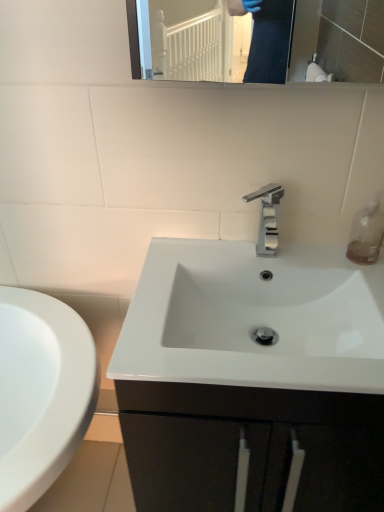
Locate an element on the screen. This screenshot has height=512, width=384. vacant area that lies in front of transparent plastic soap dispenser at upper right is located at coordinates tap(365, 280).